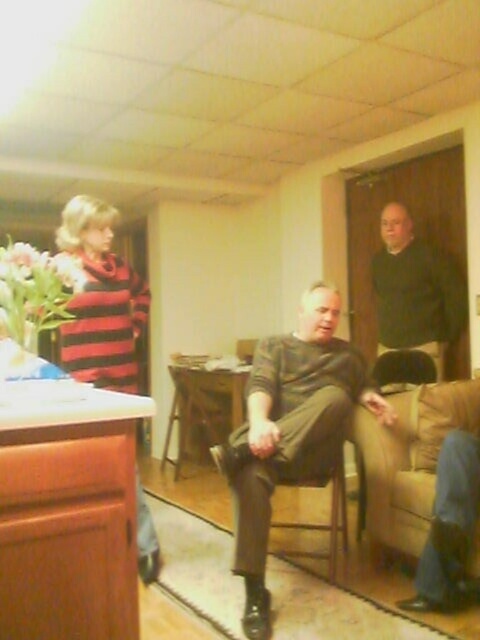
Question: Does striped sweater at left appear on the right side of wooden at center?

Choices:
 (A) yes
 (B) no

Answer: (B)

Question: Among these objects, which one is farthest from the camera?

Choices:
 (A) dark green sweater at upper right
 (B) wooden at center
 (C) striped sweater at center
 (D) beige fabric couch at lower right

Answer: (A)

Question: Which object is farther from the camera taking this photo?

Choices:
 (A) striped sweater at center
 (B) wooden at center
 (C) striped sweater at left
 (D) dark green sweater at upper right

Answer: (D)

Question: Estimate the real-world distances between objects in this image. Which object is farther from the wooden at center?

Choices:
 (A) dark green sweater at upper right
 (B) beige fabric couch at lower right

Answer: (A)

Question: Is striped sweater at center positioned behind beige fabric couch at lower right?

Choices:
 (A) yes
 (B) no

Answer: (B)

Question: Is beige fabric couch at lower right smaller than dark green sweater at upper right?

Choices:
 (A) yes
 (B) no

Answer: (B)